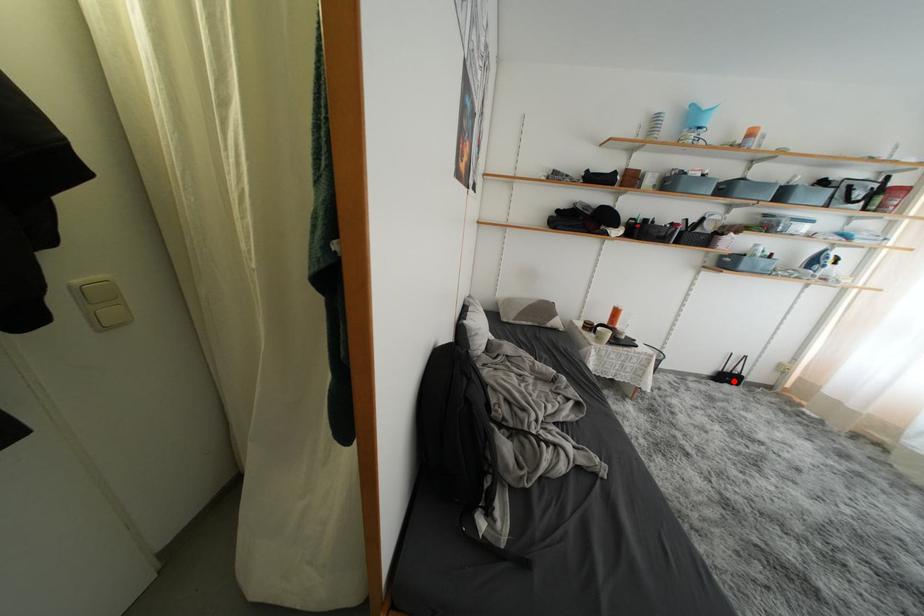
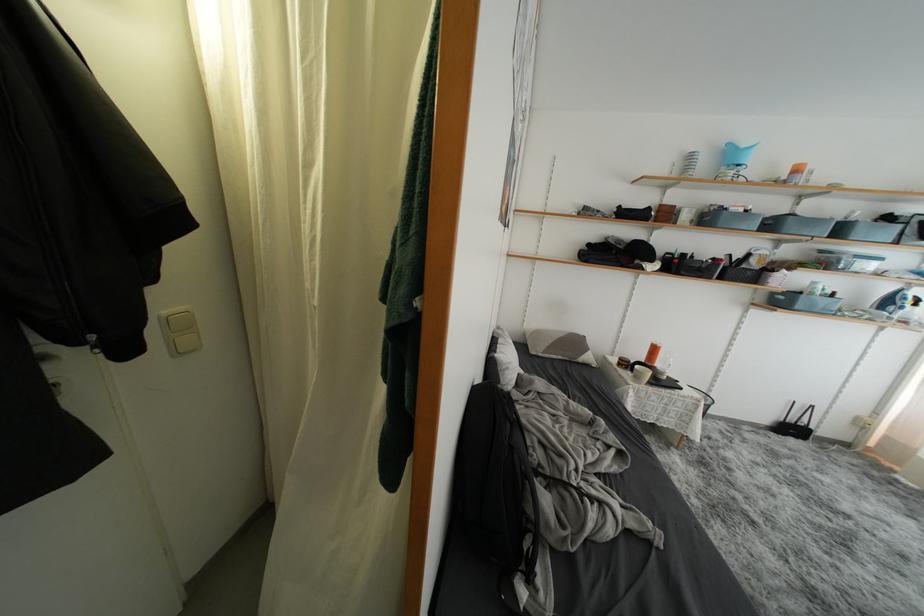
Question: I am providing you with two images of the same scene from different viewpoints. Image1 has a red point marked. In image2, the corresponding 3D location appears at what relative position? Reply with the corresponding letter.

Choices:
 (A) Closer
 (B) Farther

Answer: (A)